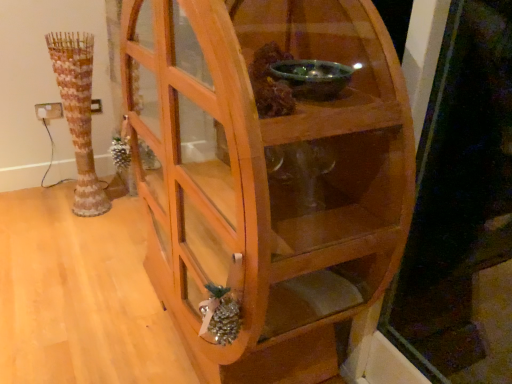
What do you see at coordinates (268, 179) in the screenshot? I see `wooden cabinet at center` at bounding box center [268, 179].

Image resolution: width=512 pixels, height=384 pixels. What are the coordinates of `wooden cabinet at center` in the screenshot? It's located at (268, 179).

Measure the distance between wooden textured vase at left and camera.

wooden textured vase at left and camera are 6.68 feet apart from each other.

At what (x,y) coordinates should I click in order to perform the action: click on wooden textured vase at left. Please return your answer as a coordinate pair (x, y). The image size is (512, 384). Looking at the image, I should click on (78, 114).

What do you see at coordinates (78, 114) in the screenshot? I see `wooden textured vase at left` at bounding box center [78, 114].

Where is `wooden cabinet at center`? This screenshot has width=512, height=384. wooden cabinet at center is located at coordinates pos(268,179).

Based on their positions, is wooden cabinet at center located to the left or right of wooden textured vase at left?

Based on their positions, wooden cabinet at center is located to the right of wooden textured vase at left.

Which object is further away from the camera, wooden cabinet at center or wooden textured vase at left?

wooden textured vase at left.

Considering the points (378, 286) and (76, 111), which point is in front, point (378, 286) or point (76, 111)?

Positioned in front is point (378, 286).

From the image's perspective, does wooden cabinet at center appear higher than wooden textured vase at left?

No, from the image's perspective, wooden cabinet at center is not on top of wooden textured vase at left.

From a real-world perspective, who is located higher, wooden cabinet at center or wooden textured vase at left?

In real-world perspective, wooden cabinet at center is above.

Which of these two, wooden cabinet at center or wooden textured vase at left, is wider?

wooden cabinet at center is wider.

In the scene shown: Is wooden cabinet at center shorter than wooden textured vase at left?

Incorrect, the height of wooden cabinet at center does not fall short of that of wooden textured vase at left.

Is wooden cabinet at center bigger or smaller than wooden textured vase at left?

Considering their sizes, wooden cabinet at center takes up more space than wooden textured vase at left.

Is wooden cabinet at center not within wooden textured vase at left?

Yes.

Are wooden cabinet at center and wooden textured vase at left making contact?

wooden cabinet at center is not next to wooden textured vase at left, and they're not touching.

Is wooden cabinet at center oriented towards wooden textured vase at left?

No.

How different are the orientations of wooden cabinet at center and wooden textured vase at left in degrees?

The facing directions of wooden cabinet at center and wooden textured vase at left are 0.00184 degrees apart.

I want to click on shelf below the wooden textured vase at left (from the image's perspective), so click(268, 179).

Considering the relative positions of wooden textured vase at left and wooden cabinet at center in the image provided, is wooden textured vase at left to the left of wooden cabinet at center from the viewer's perspective?

Yes, wooden textured vase at left is to the left of wooden cabinet at center.

In the scene shown: Considering the positions of objects wooden textured vase at left and wooden cabinet at center in the image provided, who is behind, wooden textured vase at left or wooden cabinet at center?

wooden textured vase at left is more distant.

In the scene shown: Which is nearer, (69, 53) or (278, 382)?

Point (69, 53) appears to be farther away from the viewer than point (278, 382).

From the image's perspective, does wooden textured vase at left appear higher than wooden cabinet at center?

Yes.

From a real-world perspective, relative to wooden cabinet at center, is wooden textured vase at left vertically above or below?

wooden textured vase at left is situated lower than wooden cabinet at center in the real world.

Looking at their sizes, would you say wooden textured vase at left is wider or thinner than wooden cabinet at center?

Considering their sizes, wooden textured vase at left looks slimmer than wooden cabinet at center.

Who is shorter, wooden textured vase at left or wooden cabinet at center?

Standing shorter between the two is wooden textured vase at left.

In terms of size, does wooden textured vase at left appear bigger or smaller than wooden cabinet at center?

Clearly, wooden textured vase at left is smaller in size than wooden cabinet at center.

Is wooden textured vase at left inside or outside of wooden cabinet at center?

wooden textured vase at left is not enclosed by wooden cabinet at center.

In the scene shown: Is wooden textured vase at left with wooden cabinet at center?

wooden textured vase at left and wooden cabinet at center are clearly separated.

Is wooden textured vase at left positioned with its back to wooden cabinet at center?

That's not correct — wooden textured vase at left is not looking away from wooden cabinet at center.

How different are the orientations of wooden textured vase at left and wooden cabinet at center in degrees?

The angular difference between wooden textured vase at left and wooden cabinet at center is 0.00184 degrees.

The image size is (512, 384). Find the location of `shelf lying below the wooden textured vase at left (from the image's perspective)`. shelf lying below the wooden textured vase at left (from the image's perspective) is located at coordinates (268, 179).

Locate an element on the screen. shelf positioned vertically above the wooden textured vase at left (from a real-world perspective) is located at coordinates (268, 179).

At what (x,y) coordinates should I click in order to perform the action: click on vase on the left of wooden cabinet at center. Please return your answer as a coordinate pair (x, y). The height and width of the screenshot is (384, 512). Looking at the image, I should click on (78, 114).